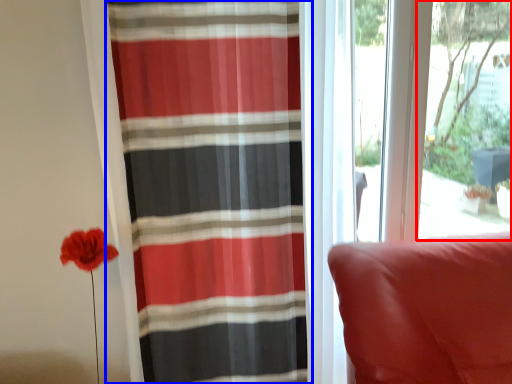
Question: Which object is further to the camera taking this photo, window screen (highlighted by a red box) or curtain (highlighted by a blue box)?

Choices:
 (A) window screen
 (B) curtain

Answer: (A)